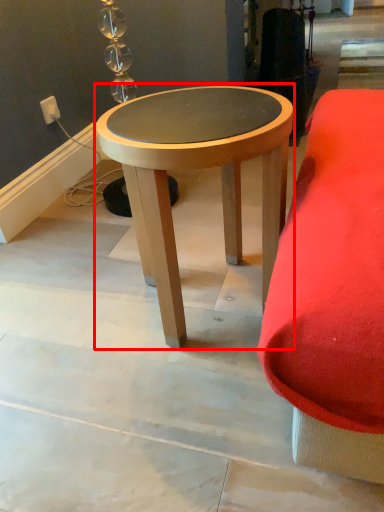
Question: From the image, what is the correct spatial relationship of coffee table (annotated by the red box) in relation to electric outlet?

Choices:
 (A) right
 (B) left

Answer: (A)